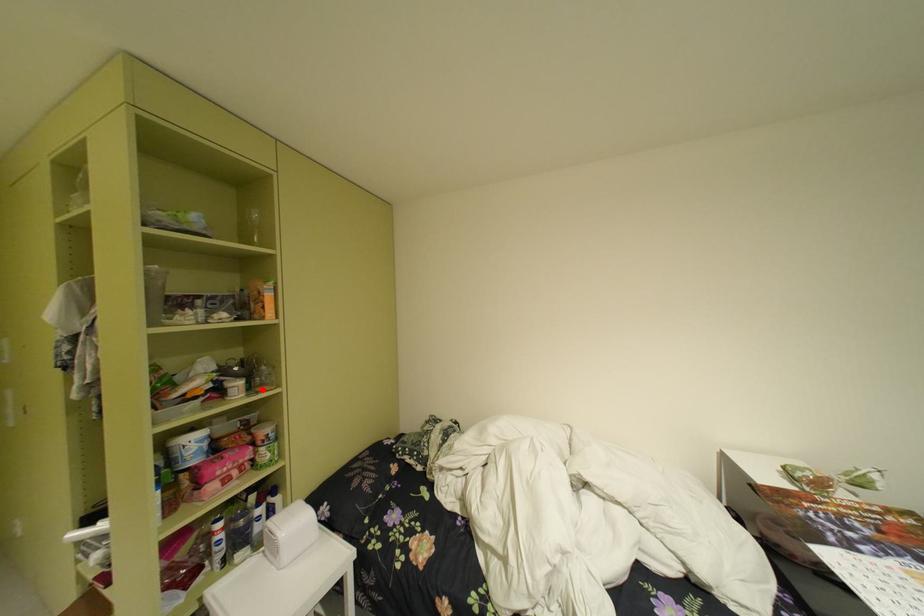
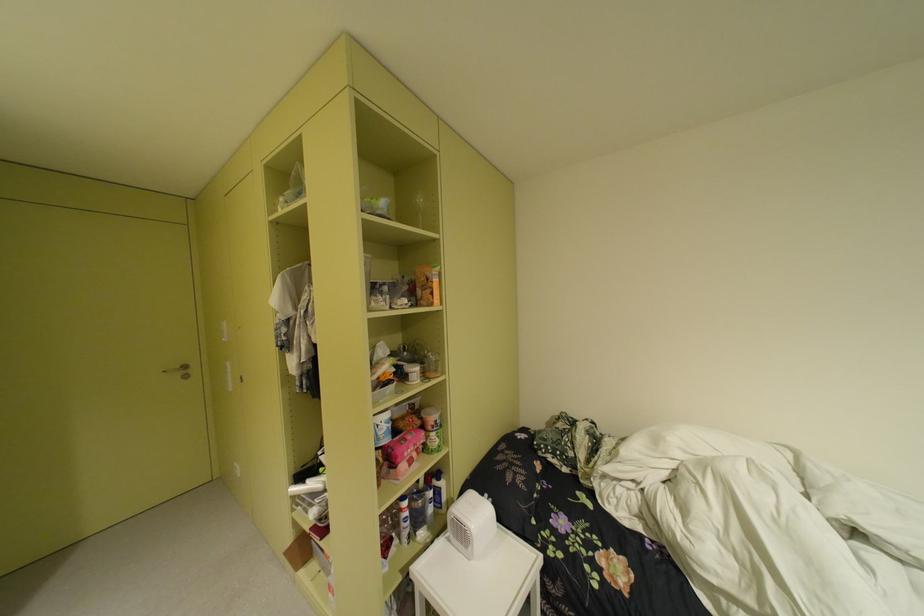
Question: I am providing you with two images of the same scene from different viewpoints. A red point is marked on the first image. At the location where the point appears in image 1, is it still visible in image 2?

Choices:
 (A) Yes
 (B) No

Answer: (A)